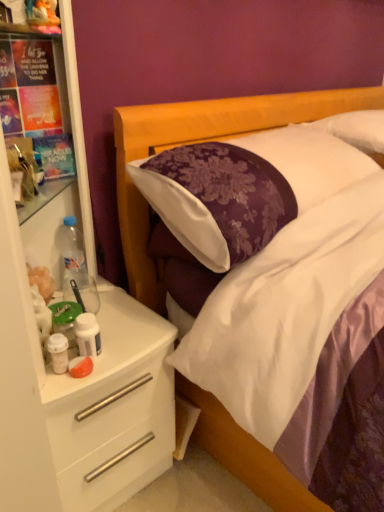
Describe the element at coordinates (88, 335) in the screenshot. I see `white glossy bottle at left, marked as the 2th bottle in a back-to-front arrangement` at that location.

This screenshot has width=384, height=512. Describe the element at coordinates (72, 256) in the screenshot. I see `clear plastic bottle at left, placed as the 2th bottle when sorted from right to left` at that location.

This screenshot has width=384, height=512. In order to click on white plastic drawer at left in this screenshot , I will do `click(114, 436)`.

Measure the distance between purple satin pillow at center and camera.

purple satin pillow at center is 35.55 inches from camera.

This screenshot has width=384, height=512. Describe the element at coordinates (75, 379) in the screenshot. I see `white plastic dresser at left` at that location.

Identify the location of white plastic dresser at left. Image resolution: width=384 pixels, height=512 pixels. (75, 379).

Where is `white glossy bottle at left, the 1th bottle viewed from the front`? This screenshot has height=512, width=384. white glossy bottle at left, the 1th bottle viewed from the front is located at coordinates (88, 335).

Is plush fabric toy at upper left outside of clear plastic bottle at left, positioned as the first bottle in left-to-right order?

Yes, plush fabric toy at upper left is located beyond the bounds of clear plastic bottle at left, positioned as the first bottle in left-to-right order.

Based on their sizes in the image, would you say plush fabric toy at upper left is bigger or smaller than clear plastic bottle at left, positioned as the first bottle in left-to-right order?

Clearly, plush fabric toy at upper left is smaller in size than clear plastic bottle at left, positioned as the first bottle in left-to-right order.

Where is `toy located above the clear plastic bottle at left, placed as the 2th bottle when sorted from right to left (from the image's perspective)`? This screenshot has height=512, width=384. toy located above the clear plastic bottle at left, placed as the 2th bottle when sorted from right to left (from the image's perspective) is located at coordinates (42, 12).

Is plush fabric toy at upper left thinner than clear plastic bottle at left, the first bottle positioned from the back?

Indeed, plush fabric toy at upper left has a lesser width compared to clear plastic bottle at left, the first bottle positioned from the back.

How different are the orientations of white plastic drawer at left and white plastic dresser at left in degrees?

0.000628 degrees.

Consider the image. Is white plastic drawer at left looking in the opposite direction of white plastic dresser at left?

white plastic drawer at left is not turned away from white plastic dresser at left.

Which of these two, white plastic drawer at left or white plastic dresser at left, is smaller?

white plastic drawer at left is smaller.

Does white plastic drawer at left lie in front of white plastic dresser at left?

No, the depth of white plastic drawer at left is greater than that of white plastic dresser at left.

From a real-world perspective, does white plastic drawer at left sit lower than purple satin pillow at center?

Yes, from a real-world perspective, white plastic drawer at left is under purple satin pillow at center.

Locate an element on the screen. pillow above the white plastic drawer at left (from a real-world perspective) is located at coordinates (244, 188).

How different are the orientations of white plastic drawer at left and purple satin pillow at center in degrees?

The angle between the facing direction of white plastic drawer at left and the facing direction of purple satin pillow at center is 2.15 degrees.

Is the depth of white plastic drawer at left greater than that of purple satin pillow at center?

Yes, white plastic drawer at left is further from the camera.

Consider the image. From a real-world perspective, is purple satin pillow at center physically located above or below white plastic dresser at left?

purple satin pillow at center is below white plastic dresser at left.

How many degrees apart are the facing directions of purple satin pillow at center and white plastic dresser at left?

purple satin pillow at center and white plastic dresser at left are facing 2.15 degrees away from each other.

The width and height of the screenshot is (384, 512). I want to click on dresser that appears on the left of purple satin pillow at center, so click(x=75, y=379).

Based on their positions, is purple satin pillow at center located to the left or right of white plastic dresser at left?

purple satin pillow at center is to the right of white plastic dresser at left.

How many degrees apart are the facing directions of purple satin pillow at center and clear plastic bottle at left, positioned as the first bottle in left-to-right order?

2.15 degrees separate the facing orientations of purple satin pillow at center and clear plastic bottle at left, positioned as the first bottle in left-to-right order.

Is purple satin pillow at center far from clear plastic bottle at left, positioned as the first bottle in left-to-right order?

purple satin pillow at center is actually quite close to clear plastic bottle at left, positioned as the first bottle in left-to-right order.

Is point (311, 168) behind point (77, 275)?

No, (311, 168) is closer to viewer.

Would you say white plastic dresser at left is inside or outside white plastic drawer at left?

white plastic dresser at left is spatially situated outside white plastic drawer at left.

Between white plastic dresser at left and white plastic drawer at left, which one appears on the right side from the viewer's perspective?

From the viewer's perspective, white plastic drawer at left appears more on the right side.

Identify the location of drawer directly beneath the white plastic dresser at left (from a real-world perspective). The image size is (384, 512). (114, 436).

Consider the image. How much distance is there between white plastic dresser at left and white plastic drawer at left?

The distance of white plastic dresser at left from white plastic drawer at left is 2.68 inches.

Can we say white glossy bottle at left, positioned as the 2th bottle in top-to-bottom order, lies outside white plastic drawer at left?

Yes.

Where is `the 1st bottle positioned above the white plastic drawer at left (from a real-world perspective)`? the 1st bottle positioned above the white plastic drawer at left (from a real-world perspective) is located at coordinates (88, 335).

Which object is positioned more to the left, white glossy bottle at left, the 1th bottle viewed from the front, or white plastic drawer at left?

From the viewer's perspective, white plastic drawer at left appears more on the left side.

In order to click on toy located in front of the clear plastic bottle at left, placed as the 2th bottle when sorted from right to left in this screenshot , I will do `click(42, 12)`.

I want to click on dresser above the white plastic drawer at left (from the image's perspective), so 75,379.

From the image, which object appears to be nearer to clear plastic bottle at left, the first bottle positioned from the back, white plastic drawer at left or white plastic dresser at left?

The object closer to clear plastic bottle at left, the first bottle positioned from the back, is white plastic dresser at left.

From the image, which object appears to be farther from white plastic drawer at left, clear plastic bottle at left, positioned as the first bottle in left-to-right order, or white plastic dresser at left?

clear plastic bottle at left, positioned as the first bottle in left-to-right order.

Based on their spatial positions, is clear plastic bottle at left, which is the second bottle in bottom-to-top order, or purple satin pillow at center further from white plastic dresser at left?

purple satin pillow at center lies further to white plastic dresser at left than the other object.

From the image, which object appears to be nearer to clear plastic bottle at left, the first bottle positioned from the back, white plastic drawer at left or plush fabric toy at upper left?

The object closer to clear plastic bottle at left, the first bottle positioned from the back, is white plastic drawer at left.

In the scene shown: Based on their spatial positions, is clear plastic bottle at left, which is the second bottle in bottom-to-top order, or white plastic dresser at left further from plush fabric toy at upper left?

The object further to plush fabric toy at upper left is white plastic dresser at left.

Looking at the image, which one is located closer to purple satin pillow at center, plush fabric toy at upper left or clear plastic bottle at left, the first bottle from the top?

Among the two, clear plastic bottle at left, the first bottle from the top, is located nearer to purple satin pillow at center.

Looking at the image, which one is located closer to purple satin pillow at center, white plastic drawer at left or white plastic dresser at left?

white plastic dresser at left is closer to purple satin pillow at center.

Consider the image. Based on their spatial positions, is clear plastic bottle at left, placed as the second bottle when sorted from front to back, or white glossy bottle at left, positioned as the first bottle in right-to-left order, further from purple satin pillow at center?

The object further to purple satin pillow at center is white glossy bottle at left, positioned as the first bottle in right-to-left order.

You are a GUI agent. You are given a task and a screenshot of the screen. Output one action in this format:
    pyautogui.click(x=<x>, y=<y>)
    Task: Click on the dresser between plush fabric toy at upper left and purple satin pillow at center from left to right
    
    Given the screenshot: What is the action you would take?
    pyautogui.click(x=75, y=379)

What are the coordinates of `dresser between plush fabric toy at upper left and white glossy bottle at left, placed as the 2th bottle when sorted from left to right, from top to bottom` in the screenshot? It's located at (75, 379).

Locate an element on the screen. Image resolution: width=384 pixels, height=512 pixels. bottle between plush fabric toy at upper left and white glossy bottle at left, marked as the 2th bottle in a back-to-front arrangement, from top to bottom is located at coordinates (72, 256).

At what (x,y) coordinates should I click in order to perform the action: click on pillow between plush fabric toy at upper left and white plastic drawer at left vertically. Please return your answer as a coordinate pair (x, y). The width and height of the screenshot is (384, 512). Looking at the image, I should click on (244, 188).